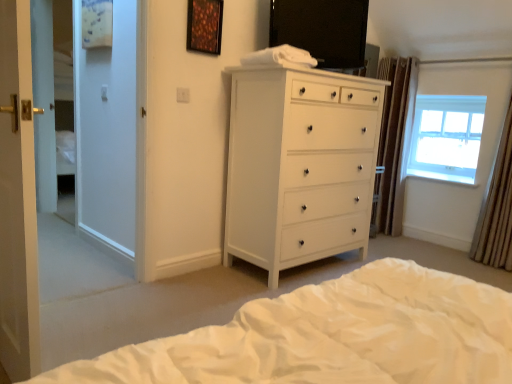
Question: Is wooden frame at upper center inside the boundaries of brown textured curtain at right, marked as the second curtain in a left-to-right arrangement, or outside?

Choices:
 (A) outside
 (B) inside

Answer: (A)

Question: Considering the positions of wooden frame at upper center and brown textured curtain at right, the 1th curtain viewed from the front, in the image, is wooden frame at upper center wider or thinner than brown textured curtain at right, the 1th curtain viewed from the front,?

Choices:
 (A) thin
 (B) wide

Answer: (A)

Question: Estimate the real-world distances between objects in this image. Which object is farther from the transparent glass window at upper right?

Choices:
 (A) white soft bed at lower center
 (B) white glossy chest of drawers at center
 (C) wooden frame at upper center
 (D) white glossy door at left
 (E) brown textured curtain at right, the first curtain viewed from the left

Answer: (D)

Question: Based on their relative distances, which object is farther from the transparent glass window at upper right?

Choices:
 (A) wooden frame at upper center
 (B) brown textured curtain at right, placed as the 2th curtain when sorted from back to front
 (C) brown textured curtain at right, the 1th curtain when ordered from back to front
 (D) white soft bed at lower center
 (E) white glossy door at left

Answer: (E)